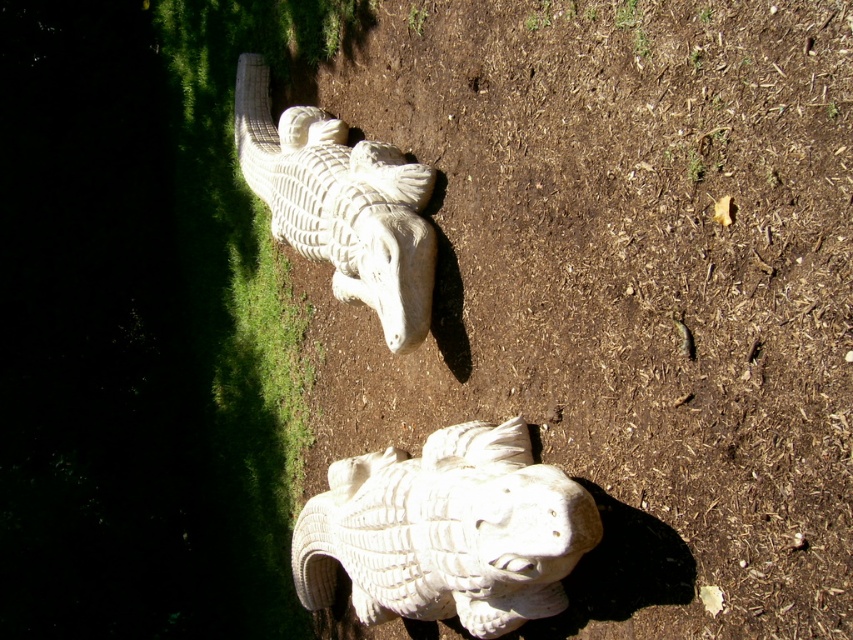
Between white stone fish at lower center and white stone crocodile at upper center, which one appears on the left side from the viewer's perspective?

white stone crocodile at upper center is more to the left.

Is white stone fish at lower center closer to the viewer compared to white stone crocodile at upper center?

Yes, it is.

Does point (424, 481) come closer to viewer compared to point (390, 218)?

Yes, it is.

Locate an element on the screen. This screenshot has height=640, width=853. white stone fish at lower center is located at coordinates (445, 531).